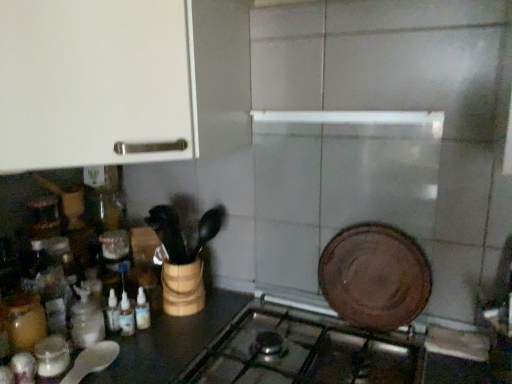
This screenshot has width=512, height=384. Describe the element at coordinates (302, 352) in the screenshot. I see `metallic silver gas stove at center` at that location.

What do you see at coordinates (126, 316) in the screenshot? The height and width of the screenshot is (384, 512). I see `translucent glass bottles at lower left, the 1th bottle viewed from the right` at bounding box center [126, 316].

The height and width of the screenshot is (384, 512). Identify the location of white matte cabinet at upper left. (93, 83).

Locate an element on the screen. translucent glass bottle at lower left, which ranks as the 2th bottle in left-to-right order is located at coordinates (86, 320).

Find the location of a particular element. metallic silver gas stove at center is located at coordinates (302, 352).

Is white matte cabinet at upper left located outside translucent glass jar at left, marked as the 3th bottle in a right-to-left arrangement?

Yes.

Considering the positions of objects white matte cabinet at upper left and translucent glass jar at left, marked as the 3th bottle in a right-to-left arrangement, in the image provided, who is in front, white matte cabinet at upper left or translucent glass jar at left, marked as the 3th bottle in a right-to-left arrangement,?

white matte cabinet at upper left is closer to the camera.

Considering the sizes of objects white matte cabinet at upper left and translucent glass jar at left, marked as the 3th bottle in a right-to-left arrangement, in the image provided, who is thinner, white matte cabinet at upper left or translucent glass jar at left, marked as the 3th bottle in a right-to-left arrangement,?

translucent glass jar at left, marked as the 3th bottle in a right-to-left arrangement, is thinner.

Is white matte cabinet at upper left aimed at translucent glass jar at left, which appears as the 1th bottle when viewed from the left?

No, white matte cabinet at upper left is not facing towards translucent glass jar at left, which appears as the 1th bottle when viewed from the left.

Is point (373, 323) closer or farther from the camera than point (88, 341)?

Clearly, point (373, 323) is more distant from the camera than point (88, 341).

Is brown matte plate at upper right at the left side of translucent glass bottle at lower left, which ranks as the 2th bottle in left-to-right order?

No.

From a real-world perspective, is brown matte plate at upper right located beneath translucent glass bottle at lower left, which ranks as the 2th bottle in left-to-right order?

Actually, brown matte plate at upper right is physically above translucent glass bottle at lower left, which ranks as the 2th bottle in left-to-right order, in the real world.

Who is smaller, brown matte plate at upper right or translucent glass bottle at lower left, which is the 2th bottle from right to left?

translucent glass bottle at lower left, which is the 2th bottle from right to left.

From the image's perspective, is brown matte plate at upper right positioned above or below translucent glass bottles at lower left, acting as the third bottle starting from the left?

From the image's perspective, brown matte plate at upper right appears above translucent glass bottles at lower left, acting as the third bottle starting from the left.

Find the location of a particular element. The width and height of the screenshot is (512, 384). kitchen appliance positioned vertically above the translucent glass bottles at lower left, acting as the third bottle starting from the left (from a real-world perspective) is located at coordinates (375, 276).

Is point (420, 297) closer to viewer compared to point (120, 324)?

Yes.

Consider the image. How many degrees apart are the facing directions of brown matte plate at upper right and translucent glass bottles at lower left, acting as the third bottle starting from the left?

88 degrees separate the facing orientations of brown matte plate at upper right and translucent glass bottles at lower left, acting as the third bottle starting from the left.

Is metallic silver gas stove at center bigger than translucent glass bottles at lower left, acting as the third bottle starting from the left?

Yes, metallic silver gas stove at center is bigger than translucent glass bottles at lower left, acting as the third bottle starting from the left.

Which object is positioned more to the left, metallic silver gas stove at center or translucent glass bottles at lower left, acting as the third bottle starting from the left?

translucent glass bottles at lower left, acting as the third bottle starting from the left.

Considering the sizes of metallic silver gas stove at center and translucent glass bottles at lower left, acting as the third bottle starting from the left, in the image, is metallic silver gas stove at center taller or shorter than translucent glass bottles at lower left, acting as the third bottle starting from the left,?

Clearly, metallic silver gas stove at center is taller compared to translucent glass bottles at lower left, acting as the third bottle starting from the left.

Is metallic silver gas stove at center positioned with its back to translucent glass bottles at lower left, acting as the third bottle starting from the left?

metallic silver gas stove at center is not turned away from translucent glass bottles at lower left, acting as the third bottle starting from the left.

Does point (133, 329) lie in front of point (341, 345)?

Yes, it is in front of point (341, 345).

From a real-world perspective, is translucent glass bottles at lower left, acting as the third bottle starting from the left, below metallic silver gas stove at center?

Incorrect, from a real-world perspective, translucent glass bottles at lower left, acting as the third bottle starting from the left, is higher than metallic silver gas stove at center.

From the image's perspective, is translucent glass bottles at lower left, the 1th bottle viewed from the right, located beneath metallic silver gas stove at center?

No.

Find the location of a particular element. gas stove in front of the translucent glass bottles at lower left, the 1th bottle viewed from the right is located at coordinates (302, 352).

From the image's perspective, which is below, metallic silver gas stove at center or white matte cabinet at upper left?

metallic silver gas stove at center, from the image's perspective.

From the picture: Which is more to the right, metallic silver gas stove at center or white matte cabinet at upper left?

metallic silver gas stove at center is more to the right.

Is metallic silver gas stove at center oriented towards white matte cabinet at upper left?

No, metallic silver gas stove at center does not turn towards white matte cabinet at upper left.

Between metallic silver gas stove at center and white matte cabinet at upper left, which one is positioned behind?

Positioned behind is metallic silver gas stove at center.

The height and width of the screenshot is (384, 512). Identify the location of bottle that is the 3rd one below the white matte cabinet at upper left (from a real-world perspective). (126, 316).

Is white matte cabinet at upper left not near translucent glass bottles at lower left, the 1th bottle viewed from the right?

That's not correct — white matte cabinet at upper left is a little close to translucent glass bottles at lower left, the 1th bottle viewed from the right.

From a real-world perspective, is white matte cabinet at upper left above or below translucent glass bottles at lower left, acting as the third bottle starting from the left?

white matte cabinet at upper left is above translucent glass bottles at lower left, acting as the third bottle starting from the left.

Based on their positions, is white matte cabinet at upper left located to the left or right of translucent glass bottles at lower left, acting as the third bottle starting from the left?

In the image, white matte cabinet at upper left appears on the left side of translucent glass bottles at lower left, acting as the third bottle starting from the left.

Where is `cabinetry to the right of translucent glass jar at left, which appears as the 1th bottle when viewed from the left`? cabinetry to the right of translucent glass jar at left, which appears as the 1th bottle when viewed from the left is located at coordinates (93, 83).

This screenshot has height=384, width=512. Find the location of `kitchen appliance in front of the translucent glass bottle at lower left, which is the 2th bottle from right to left`. kitchen appliance in front of the translucent glass bottle at lower left, which is the 2th bottle from right to left is located at coordinates (x=375, y=276).

Considering their positions, is translucent glass bottle at lower left, which is the 2th bottle from right to left, positioned further to brown matte plate at upper right than white matte cabinet at upper left?

translucent glass bottle at lower left, which is the 2th bottle from right to left.

Looking at the image, which one is located closer to metallic silver gas stove at center, translucent glass bottles at lower left, the 1th bottle viewed from the right, or translucent glass bottle at lower left, which is the 2th bottle from right to left?

translucent glass bottles at lower left, the 1th bottle viewed from the right, is closer to metallic silver gas stove at center.

Which object lies further to the anchor point translucent glass bottles at lower left, the 1th bottle viewed from the right, translucent glass bottle at lower left, which is the 2th bottle from right to left, or brown matte plate at upper right?

Based on the image, brown matte plate at upper right appears to be further to translucent glass bottles at lower left, the 1th bottle viewed from the right.

From the image, which object appears to be farther from brown matte plate at upper right, metallic silver gas stove at center or white matte cabinet at upper left?

The object further to brown matte plate at upper right is white matte cabinet at upper left.

Based on their spatial positions, is translucent glass bottles at lower left, the 1th bottle viewed from the right, or brown matte plate at upper right further from translucent glass bottle at lower left, which is the 2th bottle from right to left?

The object further to translucent glass bottle at lower left, which is the 2th bottle from right to left, is brown matte plate at upper right.

Which object lies further to the anchor point translucent glass bottles at lower left, the 1th bottle viewed from the right, translucent glass bottle at lower left, which is the 2th bottle from right to left, or metallic silver gas stove at center?

metallic silver gas stove at center is further to translucent glass bottles at lower left, the 1th bottle viewed from the right.

From the image, which object appears to be farther from translucent glass bottle at lower left, which ranks as the 2th bottle in left-to-right order, metallic silver gas stove at center or brown matte plate at upper right?

brown matte plate at upper right lies further to translucent glass bottle at lower left, which ranks as the 2th bottle in left-to-right order, than the other object.

Considering their positions, is brown matte plate at upper right positioned closer to translucent glass jar at left, marked as the 3th bottle in a right-to-left arrangement, than translucent glass bottle at lower left, which ranks as the 2th bottle in left-to-right order?

The object closer to translucent glass jar at left, marked as the 3th bottle in a right-to-left arrangement, is translucent glass bottle at lower left, which ranks as the 2th bottle in left-to-right order.

Where is `bottle located between translucent glass bottle at lower left, which ranks as the 2th bottle in left-to-right order, and metallic silver gas stove at center in the left-right direction`? bottle located between translucent glass bottle at lower left, which ranks as the 2th bottle in left-to-right order, and metallic silver gas stove at center in the left-right direction is located at coordinates (126, 316).

This screenshot has width=512, height=384. I want to click on cabinetry between translucent glass bottle at lower left, which is the 2th bottle from right to left, and brown matte plate at upper right from left to right, so click(93, 83).

Locate an element on the screen. The height and width of the screenshot is (384, 512). gas stove situated between translucent glass bottle at lower left, which is the 2th bottle from right to left, and brown matte plate at upper right from left to right is located at coordinates (302, 352).

Identify the location of bottle between translucent glass bottle at lower left, which ranks as the 2th bottle in left-to-right order, and brown matte plate at upper right. The height and width of the screenshot is (384, 512). (126, 316).